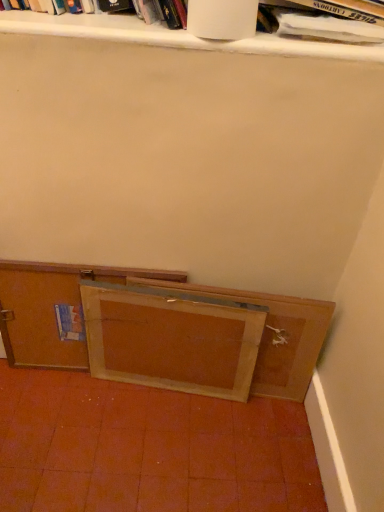
Question: Is the depth of wooden cabinet at lower left, the 2th cabinetry in the right-to-left sequence, less than that of wooden frame at lower center?

Choices:
 (A) no
 (B) yes

Answer: (A)

Question: Is wooden cabinet at lower left, which ranks as the first cabinetry in left-to-right order, bigger than wooden frame at lower center?

Choices:
 (A) no
 (B) yes

Answer: (B)

Question: Is wooden cabinet at lower left, which ranks as the first cabinetry in left-to-right order, positioned with its back to wooden frame at lower center?

Choices:
 (A) yes
 (B) no

Answer: (B)

Question: Is wooden cabinet at lower left, the 2th cabinetry in the right-to-left sequence, not within wooden frame at lower center?

Choices:
 (A) yes
 (B) no

Answer: (A)

Question: From a real-world perspective, is wooden cabinet at lower left, the 2th cabinetry in the right-to-left sequence, physically below wooden frame at lower center?

Choices:
 (A) no
 (B) yes

Answer: (A)

Question: Is wooden cabinet at lower left, the 2th cabinetry in the right-to-left sequence, positioned behind wooden frame at lower center?

Choices:
 (A) no
 (B) yes

Answer: (B)

Question: Would you consider white matte book at upper center, the second book viewed from the right, to be distant from wooden frame at lower center, the 1th cabinetry viewed from the right?

Choices:
 (A) yes
 (B) no

Answer: (B)

Question: From the image's perspective, is white matte book at upper center, the second book viewed from the right, below wooden frame at lower center, marked as the 2th cabinetry in a left-to-right arrangement?

Choices:
 (A) no
 (B) yes

Answer: (A)

Question: Is white matte book at upper center, the second book viewed from the right, wider than wooden frame at lower center, the 1th cabinetry viewed from the right?

Choices:
 (A) no
 (B) yes

Answer: (B)

Question: Is white matte book at upper center, placed as the 1th book when sorted from left to right, positioned in front of wooden frame at lower center, the 1th cabinetry viewed from the right?

Choices:
 (A) yes
 (B) no

Answer: (A)

Question: Is white matte book at upper center, the second book viewed from the right, smaller than wooden frame at lower center, marked as the 2th cabinetry in a left-to-right arrangement?

Choices:
 (A) yes
 (B) no

Answer: (B)

Question: Considering the relative positions of white matte book at upper center, the second book viewed from the right, and wooden frame at lower center, marked as the 2th cabinetry in a left-to-right arrangement, in the image provided, is white matte book at upper center, the second book viewed from the right, behind wooden frame at lower center, marked as the 2th cabinetry in a left-to-right arrangement,?

Choices:
 (A) no
 (B) yes

Answer: (A)

Question: Considering the relative sizes of wooden frame at lower center and white matte book at upper center, the second book viewed from the right, in the image provided, is wooden frame at lower center wider than white matte book at upper center, the second book viewed from the right,?

Choices:
 (A) no
 (B) yes

Answer: (A)